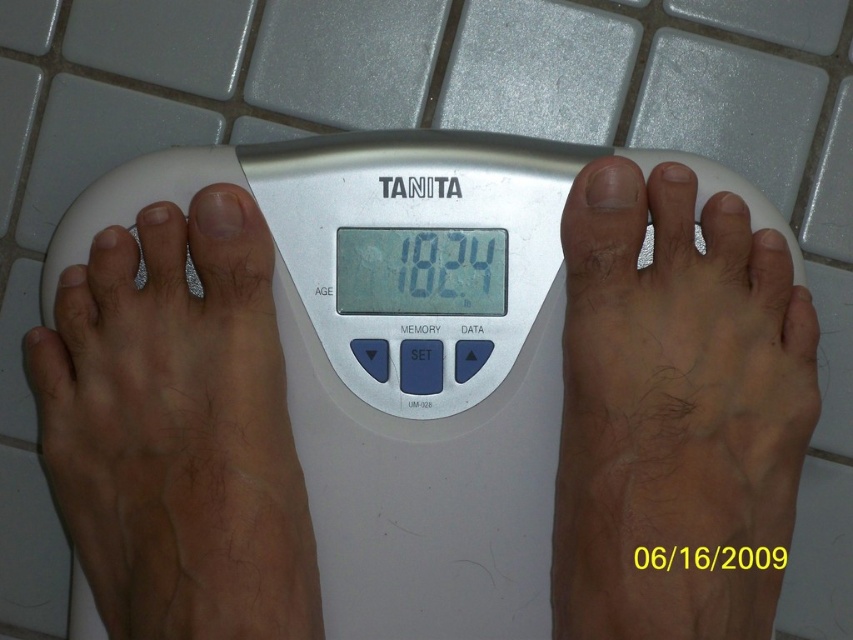
You are a physical therapist examining a patient who is standing on the white plastic weight scale at center. The patient has light brown skin at left. Can you determine if the patient is standing correctly on the scale based on their foot placement?

The white plastic weight scale at center is above light brown skin at left, indicating that the patient is standing correctly with their feet positioned on the scale.

You are a photographer setting up for a product shoot. You need to position your camera so that it captures the digital display of the white plastic weight scale at center clearly. Given that the camera and the scale are 63.32 centimeters apart, what is the minimum distance you should set between the camera and the scale to ensure the display is in focus?

The camera and the white plastic weight scale at center are 63.32 centimeters apart. To ensure the display is in focus, the minimum distance should be at least 63.32 centimeters.